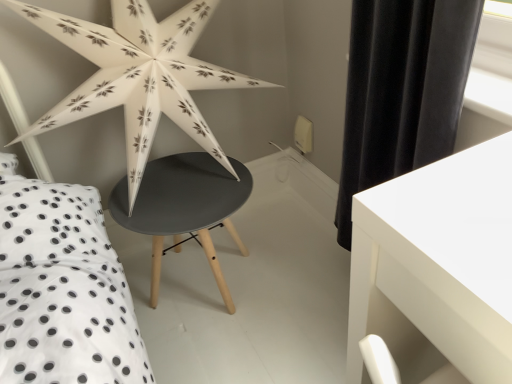
Question: From a real-world perspective, is white glossy table at lower right, the first table in the front-to-back sequence, on matte black table at center, arranged as the second table when viewed from the right?

Choices:
 (A) yes
 (B) no

Answer: (A)

Question: Is white glossy table at lower right, the first table in the front-to-back sequence, positioned before matte black table at center, which is the first table from back to front?

Choices:
 (A) yes
 (B) no

Answer: (A)

Question: Is the depth of white glossy table at lower right, the second table positioned from the left, greater than that of matte black table at center, which is the 2th table from front to back?

Choices:
 (A) no
 (B) yes

Answer: (A)

Question: Is white glossy table at lower right, the 1th table positioned from the right, positioned with its back to matte black table at center, which is the first table from back to front?

Choices:
 (A) no
 (B) yes

Answer: (A)

Question: From the image's perspective, is white glossy table at lower right, the second table positioned from the left, located above matte black table at center, arranged as the second table when viewed from the right?

Choices:
 (A) yes
 (B) no

Answer: (B)

Question: Can you confirm if white glossy table at lower right, the second table positioned from the left, is shorter than matte black table at center, arranged as the second table when viewed from the right?

Choices:
 (A) yes
 (B) no

Answer: (B)

Question: Is matte black table at center, the first table when ordered from left to right, looking in the opposite direction of white paper star at upper left?

Choices:
 (A) no
 (B) yes

Answer: (A)

Question: From a real-world perspective, is matte black table at center, which is the 2th table from front to back, located beneath white paper star at upper left?

Choices:
 (A) no
 (B) yes

Answer: (B)

Question: Is matte black table at center, arranged as the second table when viewed from the right, wider than white paper star at upper left?

Choices:
 (A) no
 (B) yes

Answer: (B)

Question: Can you confirm if matte black table at center, the first table when ordered from left to right, is thinner than white paper star at upper left?

Choices:
 (A) yes
 (B) no

Answer: (B)

Question: Does matte black table at center, arranged as the second table when viewed from the right, appear on the left side of white paper star at upper left?

Choices:
 (A) no
 (B) yes

Answer: (A)

Question: Could you tell me if matte black table at center, arranged as the second table when viewed from the right, is turned towards white paper star at upper left?

Choices:
 (A) yes
 (B) no

Answer: (B)

Question: Can you confirm if white paper star at upper left is taller than white glossy table at lower right, the second table positioned from the left?

Choices:
 (A) no
 (B) yes

Answer: (A)